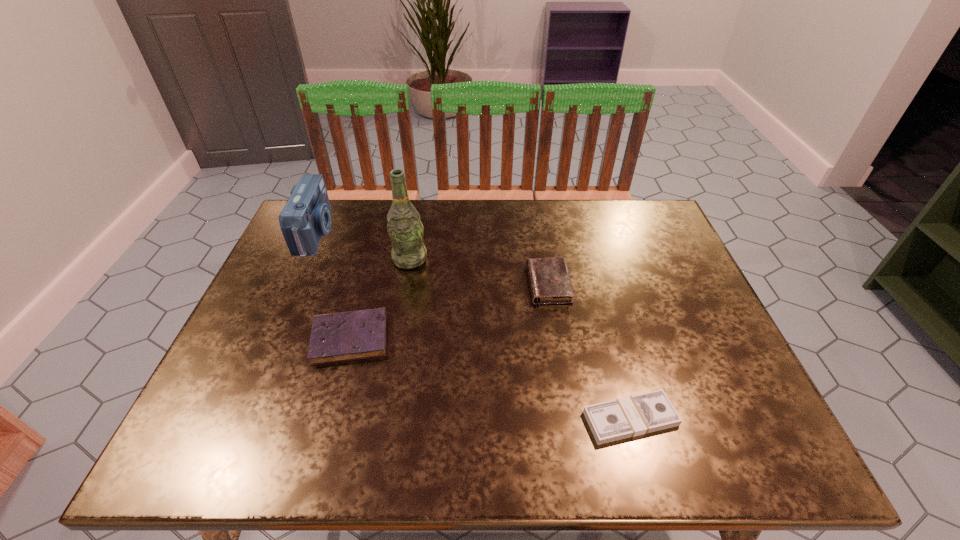
Locate an element on the screen. The height and width of the screenshot is (540, 960). free space between the dollar and the tallest object is located at coordinates (520, 339).

You are a GUI agent. You are given a task and a screenshot of the screen. Output one action in this format:
    pyautogui.click(x=<x>, y=<y>)
    Task: Click on the vacant area between the right diary and the leftmost object
    This screenshot has height=540, width=960.
    Given the screenshot: What is the action you would take?
    pyautogui.click(x=433, y=259)

I want to click on empty space that is in between the right diary and the shorter diary, so click(449, 311).

Find the location of a particular element. The width and height of the screenshot is (960, 540). the second closest object relative to the second shortest object is located at coordinates (x=306, y=216).

Identify which object is located as the second nearest to the tallest object. Please provide its 2D coordinates. Your answer should be formatted as a tuple, i.e. [(x, y)], where the tuple contains the x and y coordinates of a point satisfying the conditions above.

[(306, 216)]

At what (x,y) coordinates should I click in order to perform the action: click on free location that satisfies the following two spatial constraints: 1. on the lens of the camera; 2. on the back side of the shortest object. Please return your answer as a coordinate pair (x, y). The image size is (960, 540). Looking at the image, I should click on (233, 418).

In order to click on vacant position in the image that satisfies the following two spatial constraints: 1. on the lens of the leftmost object; 2. on the back side of the right diary in this screenshot , I will do `click(293, 284)`.

Locate an element on the screen. blank space that satisfies the following two spatial constraints: 1. on the surface of the shortest object; 2. on the left side of the beer bottle is located at coordinates (381, 418).

The height and width of the screenshot is (540, 960). What are the coordinates of `free space that satisfies the following two spatial constraints: 1. on the lens of the nearer diary; 2. on the left side of the second tallest object` in the screenshot? It's located at (269, 338).

The height and width of the screenshot is (540, 960). In order to click on vacant space that satisfies the following two spatial constraints: 1. on the surface of the tallest object; 2. on the left side of the shortest object in this screenshot , I will do `click(381, 418)`.